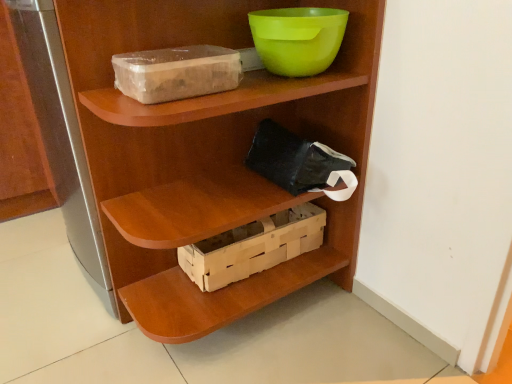
Question: In terms of height, does transparent plastic storage box at upper left look taller or shorter compared to green plastic bowl at upper center?

Choices:
 (A) short
 (B) tall

Answer: (A)

Question: In the image, is transparent plastic storage box at upper left on the left side or the right side of green plastic bowl at upper center?

Choices:
 (A) left
 (B) right

Answer: (A)

Question: Estimate the real-world distances between objects in this image. Which object is farther from the transparent plastic storage box at upper left?

Choices:
 (A) wooden shelf at center
 (B) green plastic bowl at upper center
 (C) wooden crate at center

Answer: (C)

Question: Which object is positioned closest to the green plastic bowl at upper center?

Choices:
 (A) wooden crate at center
 (B) wooden shelf at center
 (C) transparent plastic storage box at upper left

Answer: (C)